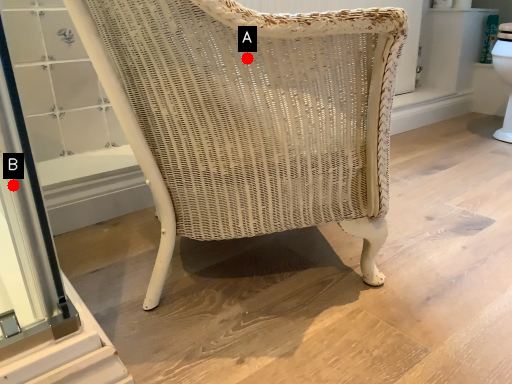
Question: Two points are circled on the image, labeled by A and B beside each circle. Which point is farther to the camera?

Choices:
 (A) A is further
 (B) B is further

Answer: (A)